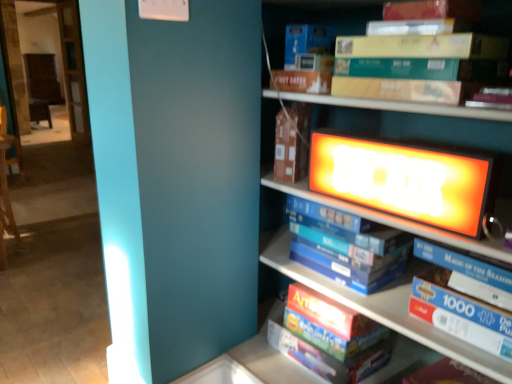
Question: Is white glossy puzzle box at center, the third book positioned from the top, facing away from matte wooden bookcase at upper right?

Choices:
 (A) yes
 (B) no

Answer: (A)

Question: From the image's perspective, is white glossy puzzle box at center, the third book positioned from the top, located beneath matte wooden bookcase at upper right?

Choices:
 (A) no
 (B) yes

Answer: (B)

Question: Is white glossy puzzle box at center, which is counted as the second book, starting from the bottom, not inside matte wooden bookcase at upper right?

Choices:
 (A) no
 (B) yes

Answer: (A)

Question: Can you confirm if white glossy puzzle box at center, which is counted as the second book, starting from the bottom, is taller than matte wooden bookcase at upper right?

Choices:
 (A) no
 (B) yes

Answer: (A)

Question: Could you tell me if white glossy puzzle box at center, which is counted as the second book, starting from the bottom, is facing matte wooden bookcase at upper right?

Choices:
 (A) yes
 (B) no

Answer: (A)

Question: Considering the relative sizes of white glossy puzzle box at center, the third book positioned from the top, and matte wooden bookcase at upper right in the image provided, is white glossy puzzle box at center, the third book positioned from the top, smaller than matte wooden bookcase at upper right?

Choices:
 (A) yes
 (B) no

Answer: (A)

Question: Considering the relative sizes of red matte puzzle box at lower center, which is counted as the fourth book, starting from the top, and yellow cardboard book at upper right, the 1th book in the top-to-bottom sequence, in the image provided, is red matte puzzle box at lower center, which is counted as the fourth book, starting from the top, smaller than yellow cardboard book at upper right, the 1th book in the top-to-bottom sequence,?

Choices:
 (A) yes
 (B) no

Answer: (B)

Question: Could you tell me if red matte puzzle box at lower center, arranged as the 1th book when ordered from the bottom, is facing yellow cardboard book at upper right, the 1th book in the top-to-bottom sequence?

Choices:
 (A) no
 (B) yes

Answer: (A)

Question: From a real-world perspective, is red matte puzzle box at lower center, which is counted as the fourth book, starting from the top, on yellow cardboard book at upper right, which is counted as the 4th book, starting from the bottom?

Choices:
 (A) no
 (B) yes

Answer: (A)

Question: From the image's perspective, does red matte puzzle box at lower center, arranged as the 1th book when ordered from the bottom, appear higher than yellow cardboard book at upper right, which is counted as the 4th book, starting from the bottom?

Choices:
 (A) no
 (B) yes

Answer: (A)

Question: Is red matte puzzle box at lower center, arranged as the 1th book when ordered from the bottom, taller than yellow cardboard book at upper right, which is counted as the 4th book, starting from the bottom?

Choices:
 (A) yes
 (B) no

Answer: (A)

Question: Is yellow cardboard book at upper right, the 1th book in the top-to-bottom sequence, at the back of red matte puzzle box at lower center, which is counted as the fourth book, starting from the top?

Choices:
 (A) yes
 (B) no

Answer: (B)

Question: Is white glossy puzzle box at center, the third book positioned from the top, completely or partially outside of brown cardboard book at center?

Choices:
 (A) yes
 (B) no

Answer: (A)